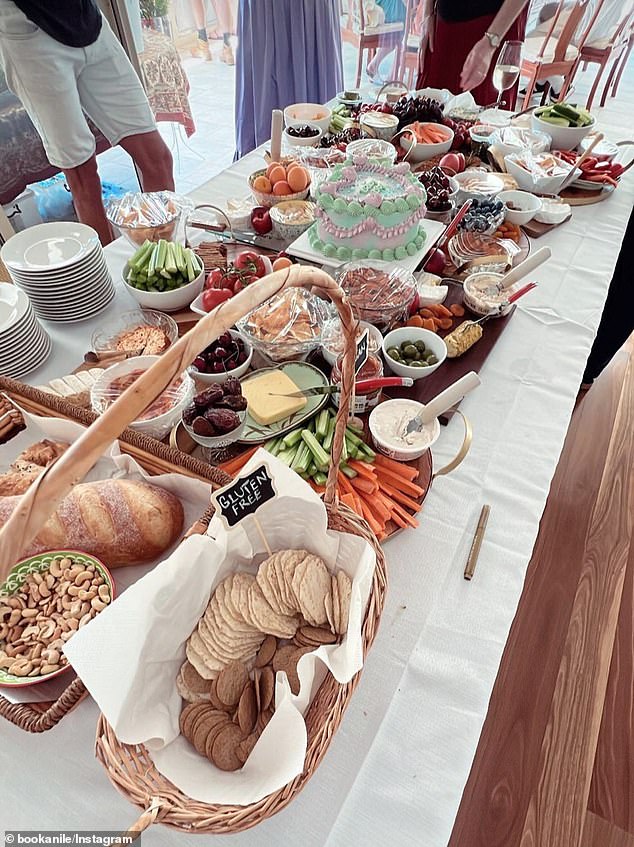
Image resolution: width=634 pixels, height=847 pixels. I want to click on table, so click(417, 650).